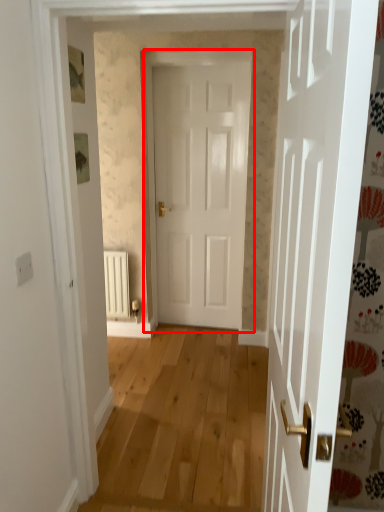
Question: From the image's perspective, what is the correct spatial positioning of door (annotated by the red box) in reference to radiator?

Choices:
 (A) below
 (B) above

Answer: (B)